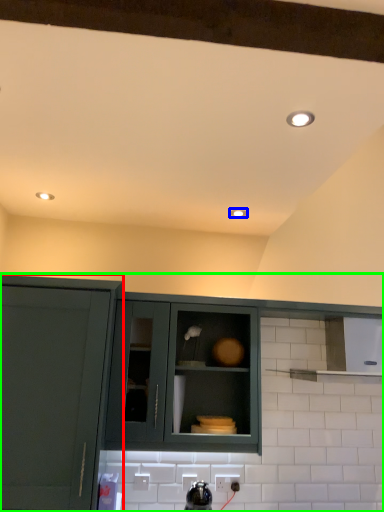
Question: Estimate the real-world distances between objects in this image. Which object is closer to cabinetry (highlighted by a red box), lighting (highlighted by a blue box) or cabinetry (highlighted by a green box)?

Choices:
 (A) lighting
 (B) cabinetry

Answer: (B)